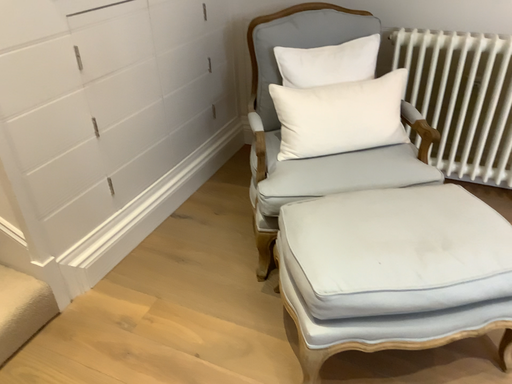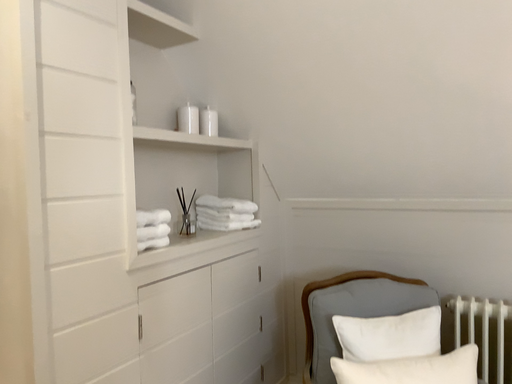
Question: How did the camera likely rotate when shooting the video?

Choices:
 (A) rotated upward
 (B) rotated downward

Answer: (A)